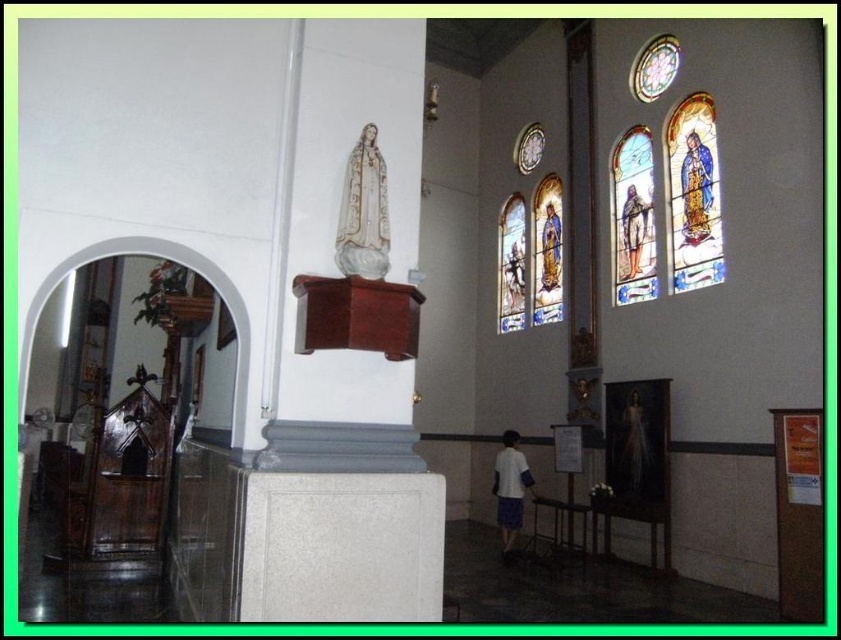
Is point (633, 131) positioned behind point (506, 234)?

No, (633, 131) is closer to viewer.

Between point (633, 147) and point (511, 256), which one is positioned behind?

The point (511, 256) is behind.

Identify the location of stained glass figure at center. The height and width of the screenshot is (640, 841). (633, 218).

Is point (616, 288) positioned before point (545, 264)?

That is True.

Is point (649, 218) positioned before point (538, 195)?

Yes, it is in front of point (538, 195).

The height and width of the screenshot is (640, 841). Find the location of `stained glass figure at center`. stained glass figure at center is located at coordinates (633, 218).

Which is more to the right, matte white statue at center or blue fabric figure at center?

blue fabric figure at center is more to the right.

Does matte white statue at center have a larger size compared to blue fabric figure at center?

Indeed, matte white statue at center has a larger size compared to blue fabric figure at center.

Does point (521, 276) come in front of point (547, 266)?

No, it is not.

The height and width of the screenshot is (640, 841). I want to click on matte white statue at center, so click(511, 275).